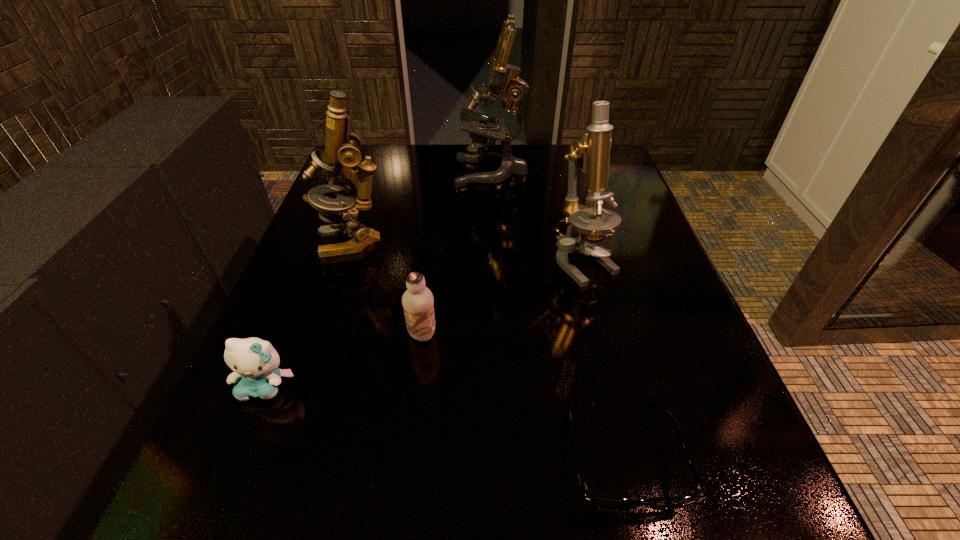
I want to click on spectacles that is positioned at the right edge, so click(599, 501).

The width and height of the screenshot is (960, 540). I want to click on object located in the near right corner section of the desktop, so click(x=599, y=501).

The image size is (960, 540). What are the coordinates of `free space at the far edge` in the screenshot? It's located at (494, 185).

The image size is (960, 540). I want to click on vacant point at the near edge, so click(x=383, y=539).

You are a GUI agent. You are given a task and a screenshot of the screen. Output one action in this format:
    pyautogui.click(x=<x>, y=<y>)
    Task: Click on the vacant space at the left edge of the desktop
    This screenshot has width=960, height=540.
    Given the screenshot: What is the action you would take?
    pyautogui.click(x=218, y=420)

In order to click on free space at the right edge of the desktop in this screenshot , I will do `click(621, 198)`.

You are a GUI agent. You are given a task and a screenshot of the screen. Output one action in this format:
    pyautogui.click(x=<x>, y=<y>)
    Task: Click on the vacant space at the far left corner
    The image size is (960, 540).
    Given the screenshot: What is the action you would take?
    pyautogui.click(x=400, y=157)

In the image, there is a desktop. At what (x,y) coordinates should I click in order to perform the action: click on free region at the far right corner. Please return your answer as a coordinate pair (x, y). The height and width of the screenshot is (540, 960). Looking at the image, I should click on (614, 179).

Where is `vacant area at the near right corner`? The image size is (960, 540). vacant area at the near right corner is located at coordinates (660, 521).

The height and width of the screenshot is (540, 960). What are the coordinates of `free space between the leftmost microscope and the rightmost microscope` in the screenshot? It's located at (468, 252).